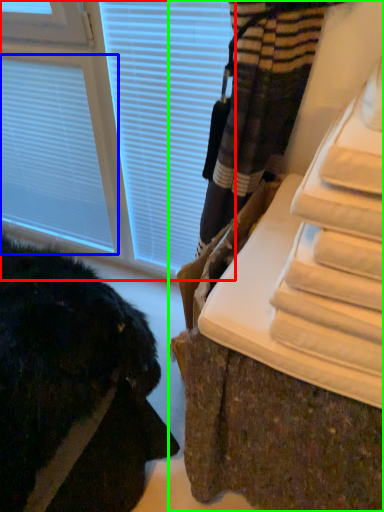
Question: Which is nearer to the window (highlighted by a red box)? blind (highlighted by a blue box) or furniture (highlighted by a green box).

Choices:
 (A) blind
 (B) furniture

Answer: (A)